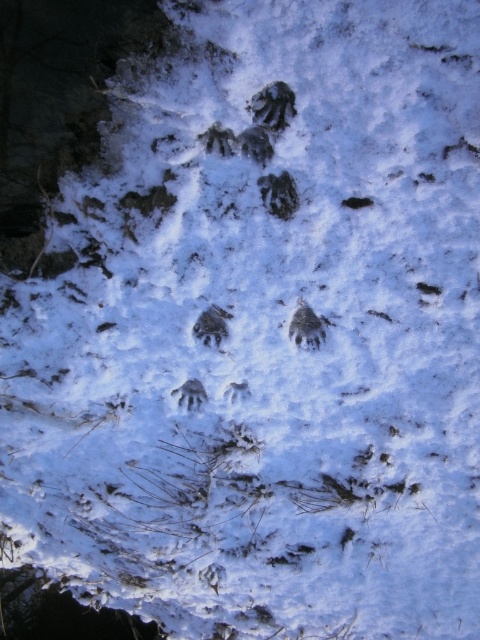
You are a wildlife researcher examining the snowy surface. You notice the brown fur at center and the dark fur paw print at center. Which object is positioned closer to your viewpoint?

The brown fur at center is closer to the viewer than the dark fur paw print at center.

From the picture: You are a wildlife researcher examining the snowy surface. You notice the brown fur at center and the dark fur paw print at center. Which object is positioned higher up in the image?

The brown fur at center is located above the dark fur paw print at center, so it is positioned higher up in the image.

You are a wildlife researcher examining the snowy surface. You notice both the brown fur at center and the dark fur paw print at center. Which object is bigger in size?

The brown fur at center is larger in size compared to the dark fur paw print at center.